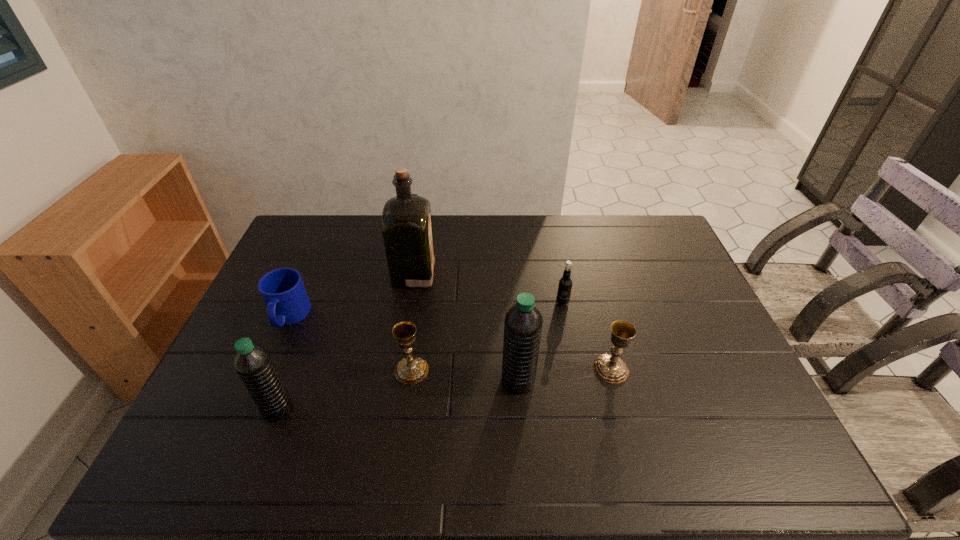
At what (x,y) coordinates should I click in order to perform the action: click on object that is at the near left corner. Please return your answer as a coordinate pair (x, y). Looking at the image, I should click on (254, 365).

In the image, there is a desktop. Identify the location of vacant space at the far edge. The image size is (960, 540). (469, 218).

Where is `vacant space at the near edge`? Image resolution: width=960 pixels, height=540 pixels. vacant space at the near edge is located at coordinates (488, 400).

The image size is (960, 540). In order to click on vacant space at the left edge of the desktop in this screenshot , I will do `click(281, 333)`.

Identify the location of vacant space at the right edge. (694, 395).

The height and width of the screenshot is (540, 960). In the image, there is a desktop. Identify the location of vacant region at the far left corner. (306, 240).

This screenshot has width=960, height=540. What are the coordinates of `vacant space at the near right corner` in the screenshot? It's located at (699, 415).

Locate an element on the screen. free area in between the mug and the root beer is located at coordinates (425, 309).

You are a GUI agent. You are given a task and a screenshot of the screen. Output one action in this format:
    pyautogui.click(x=<x>, y=<y>)
    Task: Click on the vacant space that's between the right chalice and the shortest object
    The height and width of the screenshot is (540, 960).
    Given the screenshot: What is the action you would take?
    pyautogui.click(x=450, y=343)

Locate an element on the screen. This screenshot has height=540, width=960. vacant region between the left water bottle and the second object from right to left is located at coordinates (420, 356).